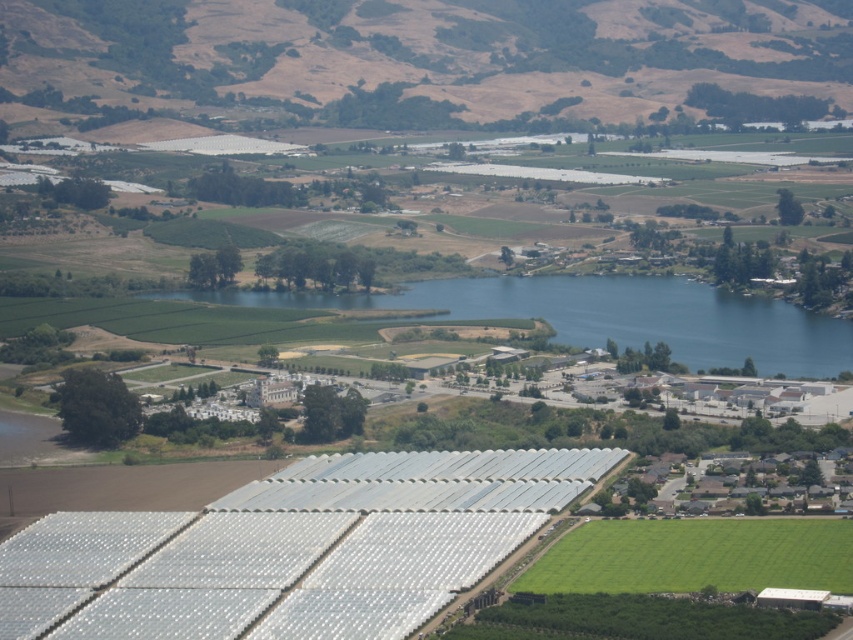
You are a drone operator tasked with surveying a rural landscape. Your mission is to locate a specific area marked by brown dry grass. The coordinates provided are point [426,60]. Based on the scene description, where would you direct the drone to find the brown dry grass?

The brown dry grass is located at point [426,60], which is the upper center area of the image.